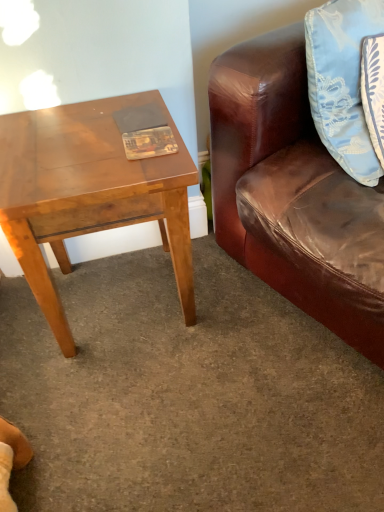
Question: In the image, is light brown wooden table at left on the left side or the right side of matte plastic book at center?

Choices:
 (A) right
 (B) left

Answer: (B)

Question: Is light brown wooden table at left taller or shorter than matte plastic book at center?

Choices:
 (A) tall
 (B) short

Answer: (A)

Question: Which is farther from the light blue satin pillow at upper right?

Choices:
 (A) light brown wooden table at left
 (B) matte plastic book at center

Answer: (A)

Question: Based on their relative distances, which object is farther from the matte plastic book at center?

Choices:
 (A) light blue satin pillow at upper right
 (B) light brown wooden table at left

Answer: (A)